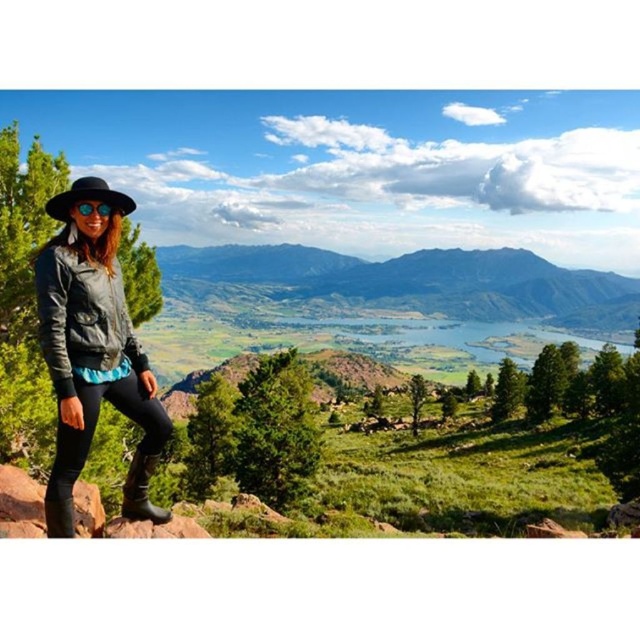
You are a photographer aiming to capture a candid shot of the person in the scene. You notice the matte black jacket at left and the sunglasses at left. How far apart are these two items on the person?

The distance between the matte black jacket at left and the sunglasses at left is 12.94 feet.

You are the person in the image standing on the rocky outcrop. You want to toss your sunglasses at left to the green grassy mountain at center. Is the mountain closer to you or farther away than your sunglasses?

The green grassy mountain at center is farther to the viewer than the sunglasses at left, so the mountain is farther away from you than your sunglasses.

You are a hiker planning to climb the green grassy mountain at center. You notice the matte black jacket at left lying on the path. Where should you place your backpack to avoid it?

The green grassy mountain at center is located above the matte black jacket at left, so you should place your backpack on the ground below the matte black jacket at left to avoid it.